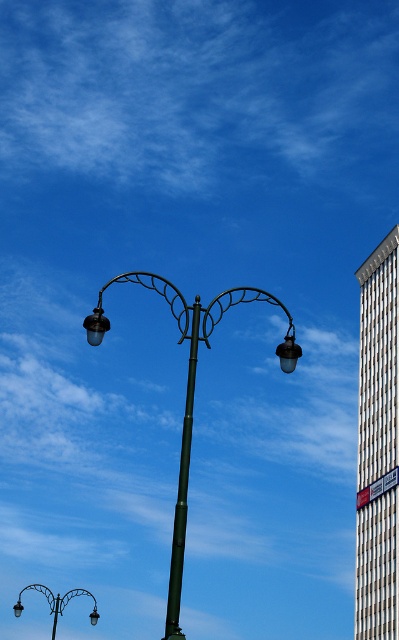
Looking at this image, is metallic green street light at center smaller than matte black street light at center?

Yes.

Is metallic green street light at center closer to camera compared to matte black street light at center?

Yes, it is.

Between point (181, 552) and point (79, 592), which one is positioned in front?

Point (181, 552) is in front.

Locate an element on the screen. This screenshot has height=640, width=399. metallic green street light at center is located at coordinates (187, 401).

Is point (183, 538) farther from viewer compared to point (98, 307)?

No, (183, 538) is in front of (98, 307).

Is green metallic pole at center to the right of matte black lamp at upper left from the viewer's perspective?

Yes, green metallic pole at center is to the right of matte black lamp at upper left.

Identify the location of green metallic pole at center. The width and height of the screenshot is (399, 640). (181, 490).

Is point (282, 307) closer to camera compared to point (175, 538)?

No, (282, 307) is behind (175, 538).

Between metallic green street light at center and green metallic pole at center, which one is positioned lower?

green metallic pole at center is below.

Between point (173, 547) and point (177, 598), which one is positioned in front?

Point (173, 547) is in front.

Locate an element on the screen. The height and width of the screenshot is (640, 399). metallic green street light at center is located at coordinates (187, 401).